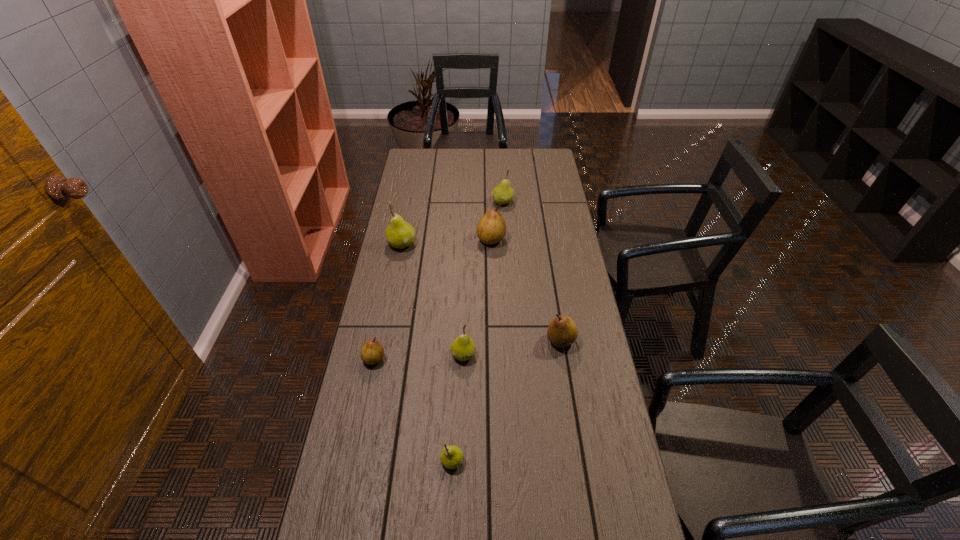
At what (x,y) coordinates should I click in order to perform the action: click on the tallest pear. Please return your answer as a coordinate pair (x, y). This screenshot has width=960, height=540. Looking at the image, I should click on (399, 234).

At what (x,y) coordinates should I click in order to perform the action: click on the tallest object. Please return your answer as a coordinate pair (x, y). Looking at the image, I should click on (399, 234).

The height and width of the screenshot is (540, 960). In order to click on the second biggest green pear in this screenshot , I will do `click(503, 193)`.

This screenshot has height=540, width=960. I want to click on the rightmost green pear, so (503, 193).

You are a GUI agent. You are given a task and a screenshot of the screen. Output one action in this format:
    pyautogui.click(x=<x>, y=<y>)
    Task: Click on the second brown pear from left to right
    
    Given the screenshot: What is the action you would take?
    pyautogui.click(x=491, y=229)

Find the location of `the biggest brown pear`. the biggest brown pear is located at coordinates (491, 229).

Locate an element on the screen. the second nearest green pear is located at coordinates (463, 348).

Find the location of `the rightmost pear`. the rightmost pear is located at coordinates (562, 331).

The width and height of the screenshot is (960, 540). Identify the location of the rightmost brown pear. (562, 331).

This screenshot has width=960, height=540. I want to click on the smallest brown pear, so click(372, 352).